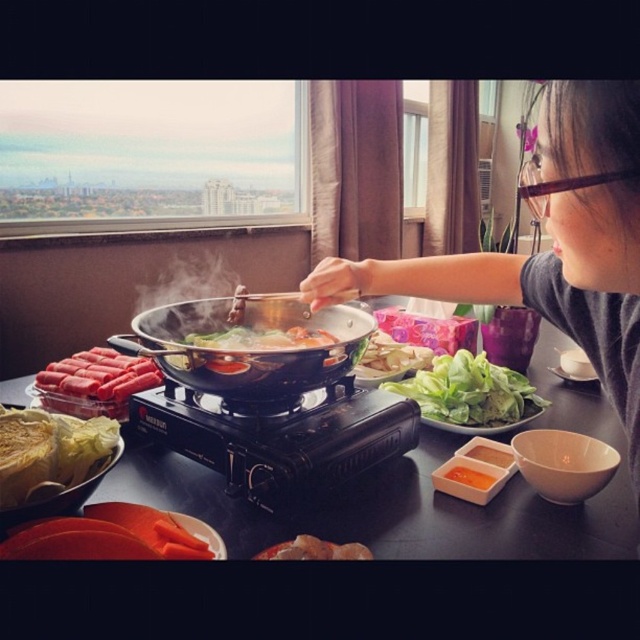
Between white smoke at center and translucent orange liquid at center, which one has more height?

white smoke at center

Between point (150, 323) and point (461, 483), which one is positioned behind?

The point (150, 323) is behind.

Identify the location of white smoke at center. The height and width of the screenshot is (640, 640). (186, 296).

Between translucent plastic container at lower left and translucent orange liquid at center, which one appears on the right side from the viewer's perspective?

translucent orange liquid at center is more to the right.

Can you confirm if translucent plastic container at lower left is thinner than translucent orange liquid at center?

Incorrect, translucent plastic container at lower left's width is not less than translucent orange liquid at center's.

The image size is (640, 640). I want to click on translucent plastic container at lower left, so click(x=93, y=381).

Measure the distance between shiny silver wok at center and green leafy lettuce at center.

They are 11.12 inches apart.

This screenshot has width=640, height=640. I want to click on shiny silver wok at center, so click(248, 349).

Identify the location of shiny silver wok at center. (248, 349).